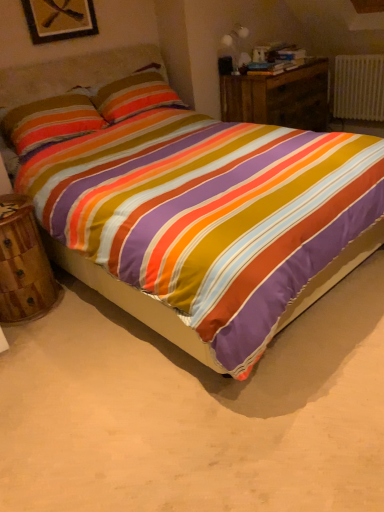
You are a GUI agent. You are given a task and a screenshot of the screen. Output one action in this format:
    pyautogui.click(x=<x>, y=<y>)
    Task: Click on the free space in front of wooden nightstand at lower left, the second nightstand from the right
    The width and height of the screenshot is (384, 512).
    Given the screenshot: What is the action you would take?
    pyautogui.click(x=33, y=339)